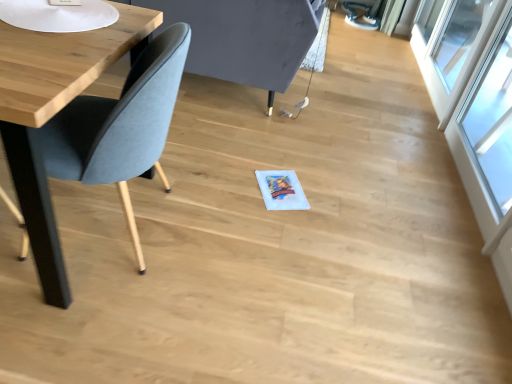
I want to click on transparent glass window at right, marked as the second window in a back-to-front arrangement, so click(492, 120).

Describe the element at coordinates (120, 120) in the screenshot. I see `matte blue chair at left` at that location.

How much space does transparent glass window at upper right, acting as the second window starting from the front, occupy vertically?

It is 32.67 inches.

This screenshot has width=512, height=384. I want to click on transparent glass window at right, marked as the second window in a back-to-front arrangement, so click(492, 120).

Which point is more distant from viewer, (501, 204) or (265, 19)?

Positioned behind is point (265, 19).

Is transparent glass window at right, which is the first window in front-to-back order, completely or partially outside of soft gray fabric swivel chair at left?

transparent glass window at right, which is the first window in front-to-back order, lies outside soft gray fabric swivel chair at left's area.

From a real-world perspective, is transparent glass window at right, which is the first window in front-to-back order, physically located above or below soft gray fabric swivel chair at left?

From a real-world perspective, transparent glass window at right, which is the first window in front-to-back order, is physically above soft gray fabric swivel chair at left.

At what (x,y) coordinates should I click in order to perform the action: click on the 1st window to the right when counting from the soft gray fabric swivel chair at left. Please return your answer as a coordinate pair (x, y). This screenshot has height=384, width=512. Looking at the image, I should click on (492, 120).

Is matte blue chair at left surrounding transparent glass window at right, marked as the second window in a back-to-front arrangement?

No.

Is matte blue chair at left in contact with transparent glass window at right, marked as the second window in a back-to-front arrangement?

No, matte blue chair at left is not beside transparent glass window at right, marked as the second window in a back-to-front arrangement.

How many degrees apart are the facing directions of matte blue chair at left and transparent glass window at right, which is the first window in front-to-back order?

They differ by 92.6 degrees in their facing directions.

Is matte blue chair at left wider than transparent glass window at right, which is the first window in front-to-back order?

Correct, the width of matte blue chair at left exceeds that of transparent glass window at right, which is the first window in front-to-back order.

Between soft gray fabric swivel chair at left and matte blue chair at left, which one has smaller width?

matte blue chair at left.

Which object is further away from the camera taking this photo, soft gray fabric swivel chair at left or matte blue chair at left?

soft gray fabric swivel chair at left is further away from the camera.

Can we say soft gray fabric swivel chair at left lies outside matte blue chair at left?

Yes, soft gray fabric swivel chair at left is located beyond the bounds of matte blue chair at left.

From a real-world perspective, which is physically below, transparent glass window at upper right, acting as the second window starting from the front, or soft gray fabric swivel chair at left?

soft gray fabric swivel chair at left.

Which object is closer to the camera, transparent glass window at upper right, acting as the second window starting from the front, or soft gray fabric swivel chair at left?

soft gray fabric swivel chair at left is in front.

Considering the sizes of transparent glass window at upper right, which is the 1th window from back to front, and soft gray fabric swivel chair at left in the image, is transparent glass window at upper right, which is the 1th window from back to front, wider or thinner than soft gray fabric swivel chair at left?

transparent glass window at upper right, which is the 1th window from back to front, is thinner than soft gray fabric swivel chair at left.

Are transparent glass window at upper right, which is the 1th window from back to front, and soft gray fabric swivel chair at left beside each other?

No, transparent glass window at upper right, which is the 1th window from back to front, is not making contact with soft gray fabric swivel chair at left.

Does transparent glass window at upper right, acting as the second window starting from the front, touch matte blue chair at left?

transparent glass window at upper right, acting as the second window starting from the front, is not next to matte blue chair at left, and they're not touching.

Considering the positions of objects transparent glass window at upper right, acting as the second window starting from the front, and matte blue chair at left in the image provided, who is more to the right, transparent glass window at upper right, acting as the second window starting from the front, or matte blue chair at left?

Positioned to the right is transparent glass window at upper right, acting as the second window starting from the front.

Where is `chair located underneath the transparent glass window at upper right, which is the 1th window from back to front (from a real-world perspective)`? This screenshot has height=384, width=512. chair located underneath the transparent glass window at upper right, which is the 1th window from back to front (from a real-world perspective) is located at coordinates (120, 120).

Can you confirm if transparent glass window at upper right, acting as the second window starting from the front, is taller than transparent glass window at right, which is the first window in front-to-back order?

Correct, transparent glass window at upper right, acting as the second window starting from the front, is much taller as transparent glass window at right, which is the first window in front-to-back order.

From a real-world perspective, which object stands above the other?

In real-world perspective, transparent glass window at right, which is the first window in front-to-back order, is above.

Where is `window located on the left of transparent glass window at upper right, acting as the second window starting from the front`? This screenshot has width=512, height=384. window located on the left of transparent glass window at upper right, acting as the second window starting from the front is located at coordinates (492, 120).

Considering the sizes of objects transparent glass window at upper right, acting as the second window starting from the front, and transparent glass window at right, which is the first window in front-to-back order, in the image provided, who is bigger, transparent glass window at upper right, acting as the second window starting from the front, or transparent glass window at right, which is the first window in front-to-back order,?

transparent glass window at upper right, acting as the second window starting from the front, is bigger.

Between point (144, 67) and point (295, 8), which one is positioned behind?

The point (295, 8) is more distant.

What's the angular difference between matte blue chair at left and soft gray fabric swivel chair at left's facing directions?

The facing directions of matte blue chair at left and soft gray fabric swivel chair at left are 1.5 degrees apart.

Looking at this image, is matte blue chair at left taller than soft gray fabric swivel chair at left?

Correct, matte blue chair at left is much taller as soft gray fabric swivel chair at left.

Consider the image. From the image's perspective, does matte blue chair at left appear higher than soft gray fabric swivel chair at left?

No, from the image's perspective, matte blue chair at left is not over soft gray fabric swivel chair at left.

At what (x,y) coordinates should I click in order to perform the action: click on swivel chair above the transparent glass window at right, marked as the second window in a back-to-front arrangement (from the image's perspective). Please return your answer as a coordinate pair (x, y). The image size is (512, 384). Looking at the image, I should click on (245, 38).

The image size is (512, 384). In the image, there is a transparent glass window at right, marked as the second window in a back-to-front arrangement. What are the coordinates of `chair below it (from a real-world perspective)` in the screenshot? It's located at (120, 120).

Considering their positions, is transparent glass window at upper right, acting as the second window starting from the front, positioned further to matte blue chair at left than soft gray fabric swivel chair at left?

transparent glass window at upper right, acting as the second window starting from the front, is further to matte blue chair at left.

From the image, which object appears to be nearer to transparent glass window at upper right, acting as the second window starting from the front, matte blue chair at left or soft gray fabric swivel chair at left?

soft gray fabric swivel chair at left is closer to transparent glass window at upper right, acting as the second window starting from the front.

When comparing their distances from transparent glass window at upper right, which is the 1th window from back to front, does transparent glass window at right, which is the first window in front-to-back order, or matte blue chair at left seem closer?

transparent glass window at right, which is the first window in front-to-back order, is positioned closer to the anchor transparent glass window at upper right, which is the 1th window from back to front.

Which object lies nearer to the anchor point soft gray fabric swivel chair at left, matte blue chair at left or transparent glass window at upper right, which is the 1th window from back to front?

Based on the image, matte blue chair at left appears to be nearer to soft gray fabric swivel chair at left.

When comparing their distances from transparent glass window at right, which is the first window in front-to-back order, does soft gray fabric swivel chair at left or transparent glass window at upper right, acting as the second window starting from the front, seem further?

Among the two, soft gray fabric swivel chair at left is located further to transparent glass window at right, which is the first window in front-to-back order.

From the image, which object appears to be farther from transparent glass window at right, which is the first window in front-to-back order, matte blue chair at left or soft gray fabric swivel chair at left?

The object further to transparent glass window at right, which is the first window in front-to-back order, is matte blue chair at left.

Considering their positions, is transparent glass window at right, which is the first window in front-to-back order, positioned closer to matte blue chair at left than transparent glass window at upper right, acting as the second window starting from the front?

The object closer to matte blue chair at left is transparent glass window at right, which is the first window in front-to-back order.

Considering their positions, is transparent glass window at right, which is the first window in front-to-back order, positioned further to soft gray fabric swivel chair at left than matte blue chair at left?

transparent glass window at right, which is the first window in front-to-back order.

You are a GUI agent. You are given a task and a screenshot of the screen. Output one action in this format:
    pyautogui.click(x=<x>, y=<y>)
    Task: Click on the window located between soft gray fabric swivel chair at left and transparent glass window at upper right, which is the 1th window from back to front, in the left-right direction
    
    Given the screenshot: What is the action you would take?
    pos(492,120)

At what (x,y) coordinates should I click in order to perform the action: click on window between matte blue chair at left and transparent glass window at upper right, acting as the second window starting from the front. Please return your answer as a coordinate pair (x, y). This screenshot has height=384, width=512. Looking at the image, I should click on (492, 120).

This screenshot has height=384, width=512. I want to click on swivel chair located between matte blue chair at left and transparent glass window at right, marked as the second window in a back-to-front arrangement, in the left-right direction, so tap(245, 38).

Image resolution: width=512 pixels, height=384 pixels. In order to click on swivel chair between matte blue chair at left and transparent glass window at upper right, acting as the second window starting from the front, in the horizontal direction in this screenshot , I will do `click(245, 38)`.